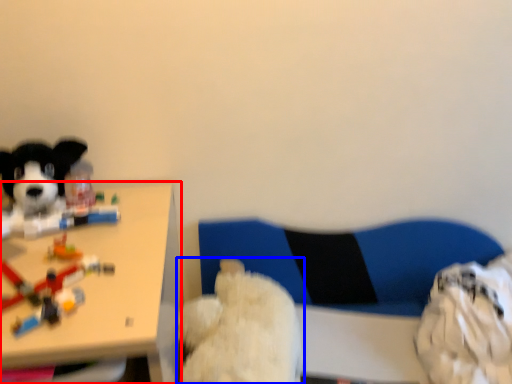
Question: Which of the following is the farthest to the observer, table (highlighted by a red box) or dog (highlighted by a blue box)?

Choices:
 (A) table
 (B) dog

Answer: (B)